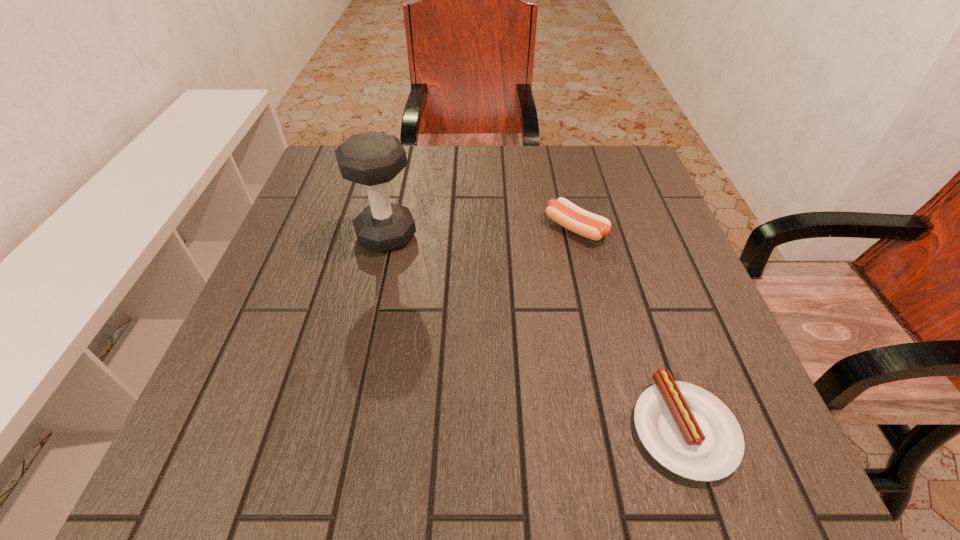
I want to click on blank area in the image that satisfies the following two spatial constraints: 1. on the back side of the tallest object; 2. on the right side of the farther sausage, so (x=388, y=228).

Where is `free location that satisfies the following two spatial constraints: 1. on the back side of the farther sausage; 2. on the right side of the leftmost object`? This screenshot has height=540, width=960. free location that satisfies the following two spatial constraints: 1. on the back side of the farther sausage; 2. on the right side of the leftmost object is located at coordinates click(388, 228).